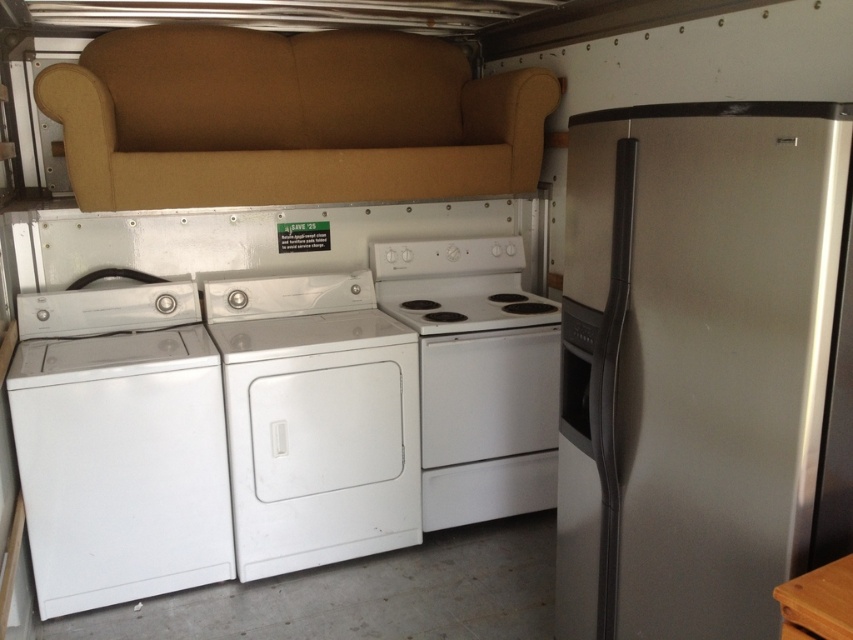
You are standing in the truck and want to place a new item between the two points labeled point (764,497) and point (415,67). Which point should you move towards first to place the item closer to the front of the truck?

You should move towards point (764,497) first because it is closer to the camera, meaning it is nearer to the front of the truck compared to point (415,67).